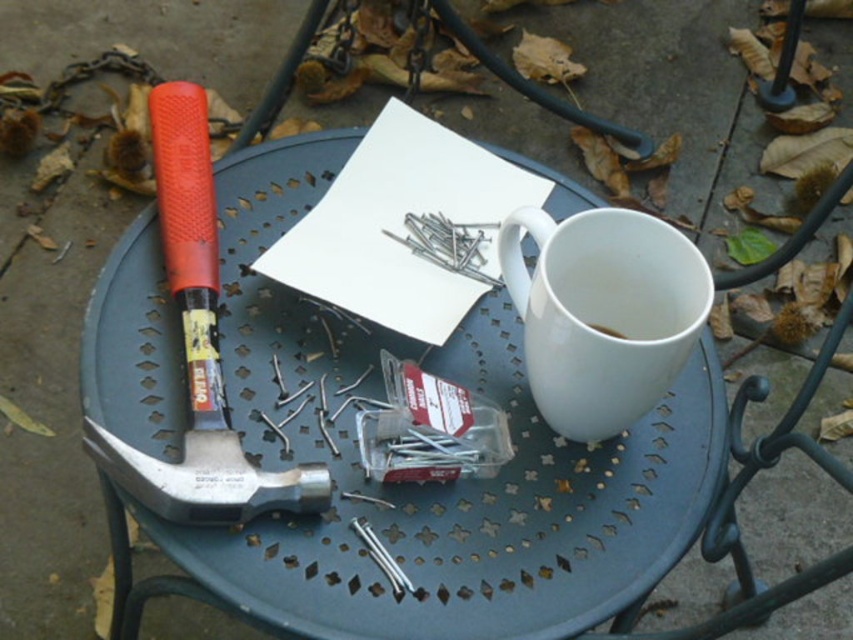
Question: Is white ceramic mug at right wider than rubberized metal hammer at left?

Choices:
 (A) yes
 (B) no

Answer: (B)

Question: Which of the following is the farthest from the observer?

Choices:
 (A) white matte cup at upper right
 (B) metallic gray table at center

Answer: (A)

Question: Which of the following is the closest to the observer?

Choices:
 (A) white matte cup at upper right
 (B) white ceramic mug at right

Answer: (B)

Question: Which of the following is the closest to the observer?

Choices:
 (A) white ceramic mug at right
 (B) metallic gray table at center

Answer: (A)

Question: Can you confirm if white ceramic mug at right is bigger than rubberized metal hammer at left?

Choices:
 (A) no
 (B) yes

Answer: (A)

Question: Is rubberized metal hammer at left above white matte cup at upper right?

Choices:
 (A) yes
 (B) no

Answer: (A)